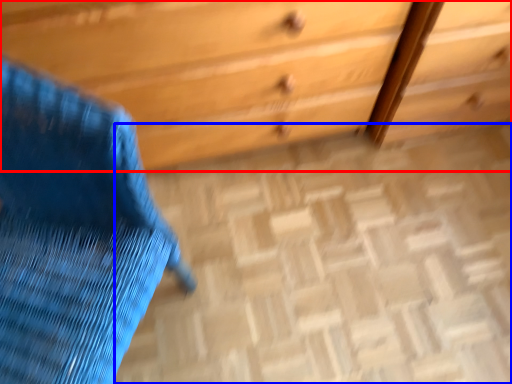
Question: Which of the following is the closest to the observer, chest of drawers (highlighted by a red box) or plain (highlighted by a blue box)?

Choices:
 (A) chest of drawers
 (B) plain

Answer: (A)